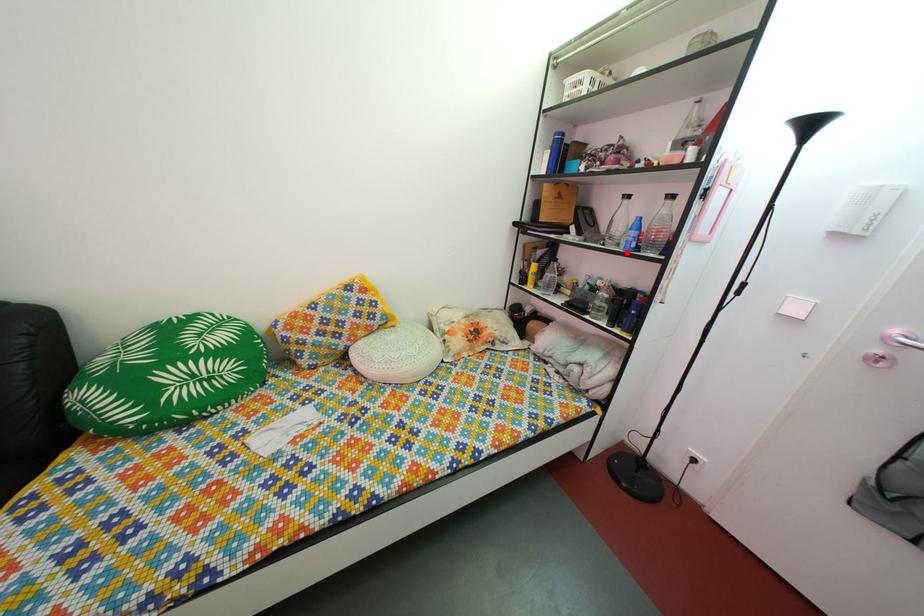
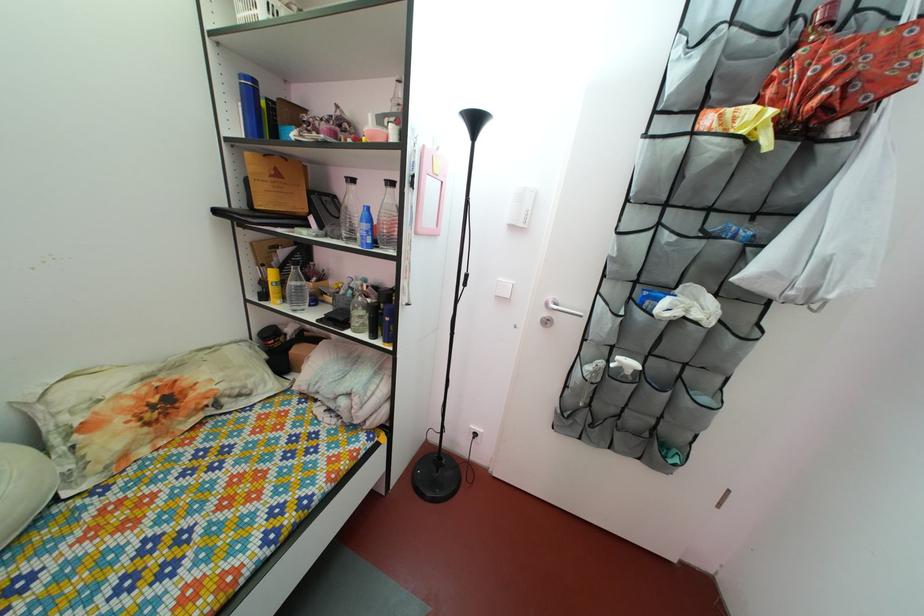
Find the pixel in the second image that matches the highlighted location in the first image.

(363, 248)